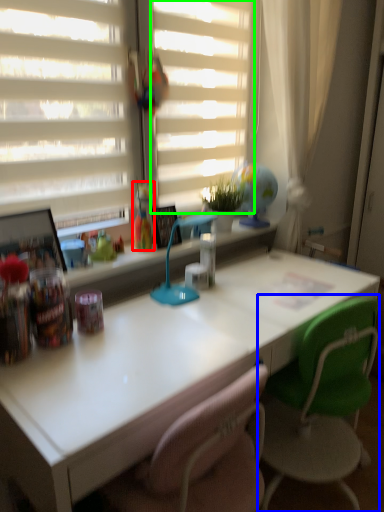
Question: Which object is the farthest from toy (highlighted by a red box)? Choose among these: chair (highlighted by a blue box) or blind (highlighted by a green box).

Choices:
 (A) chair
 (B) blind

Answer: (A)